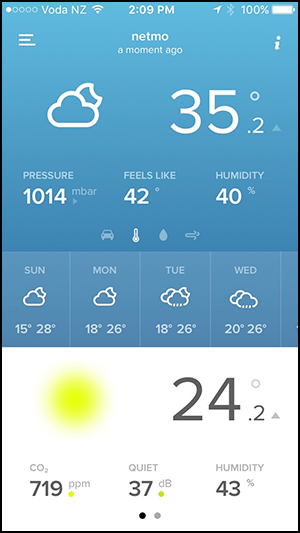
Where is `wifi`? wifi is located at coordinates (101, 9).